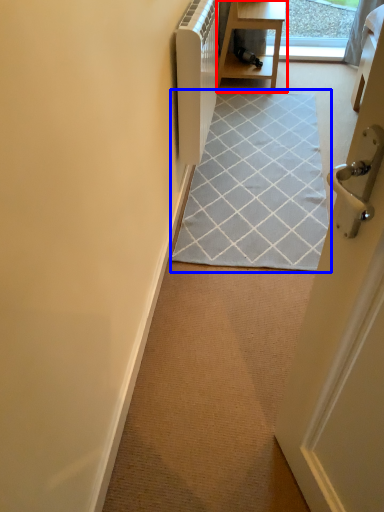
Question: Which object appears closest to the camera in this image, table (highlighted by a red box) or doormat (highlighted by a blue box)?

Choices:
 (A) table
 (B) doormat

Answer: (B)